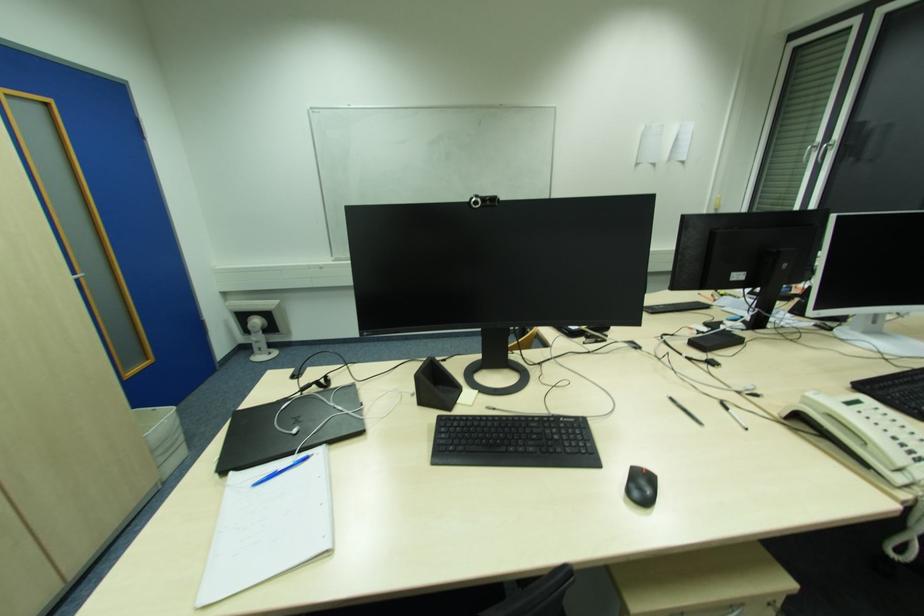
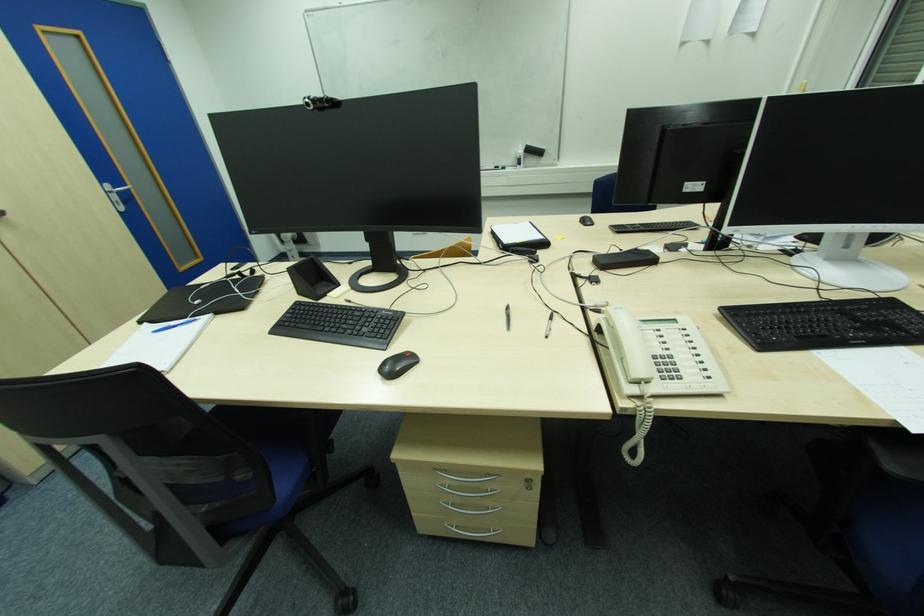
Question: What movement of the cameraman would produce the second image?

Choices:
 (A) Left
 (B) Right
 (C) Forward
 (D) Backward

Answer: (B)